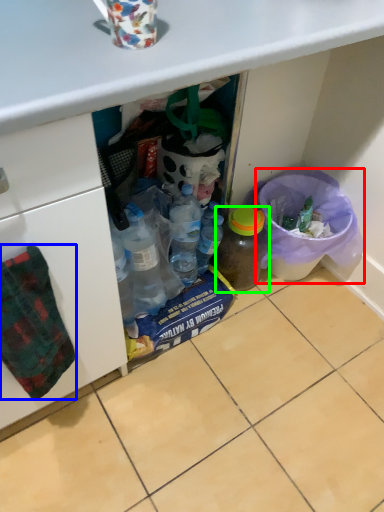
Question: Estimate the real-world distances between objects in this image. Which object is closer to recycling bin (highlighted by a red box), blanket (highlighted by a blue box) or bottle (highlighted by a green box)?

Choices:
 (A) blanket
 (B) bottle

Answer: (B)